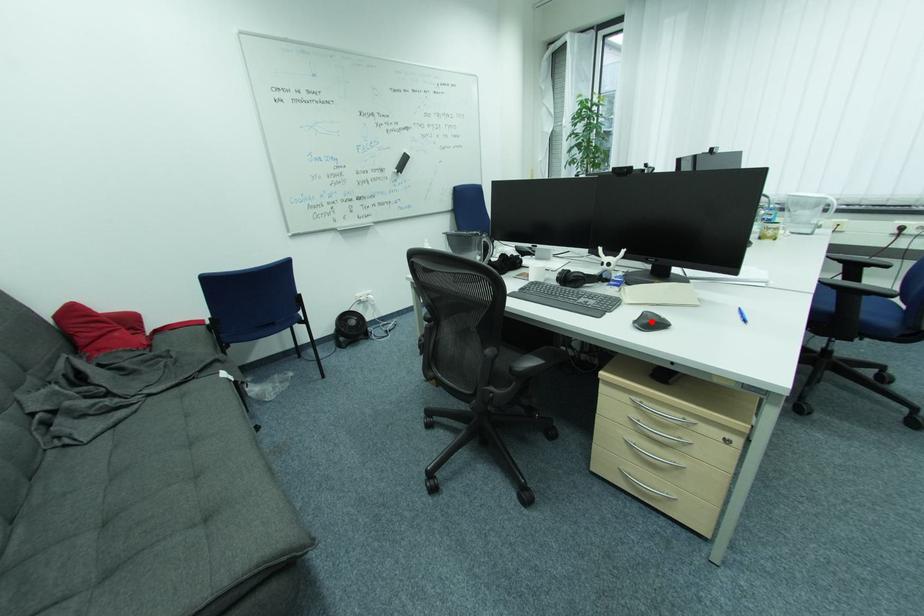
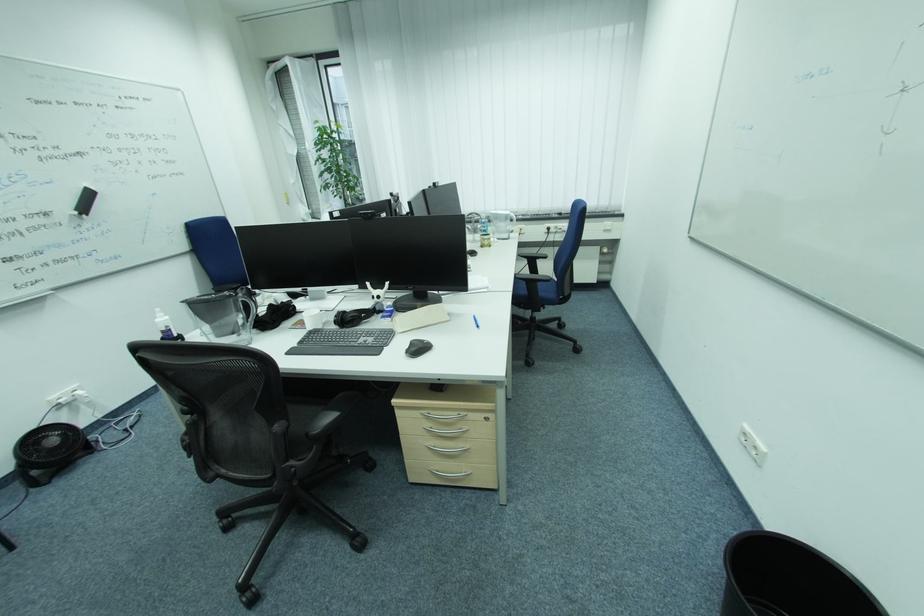
Where in the second image is the point corresponding to the highlighted location from the first image?

(419, 350)